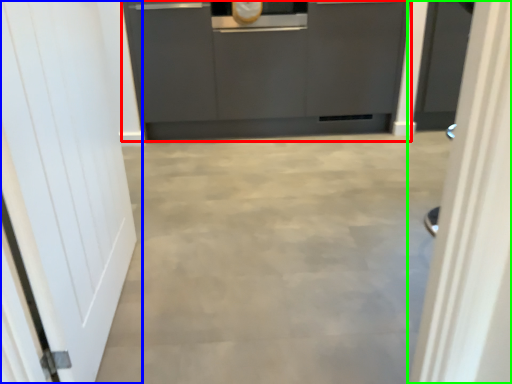
Question: Which object is positioned farthest from cabinetry (highlighted by a red box)? Select from door (highlighted by a blue box) and door (highlighted by a green box).

Choices:
 (A) door
 (B) door

Answer: (B)